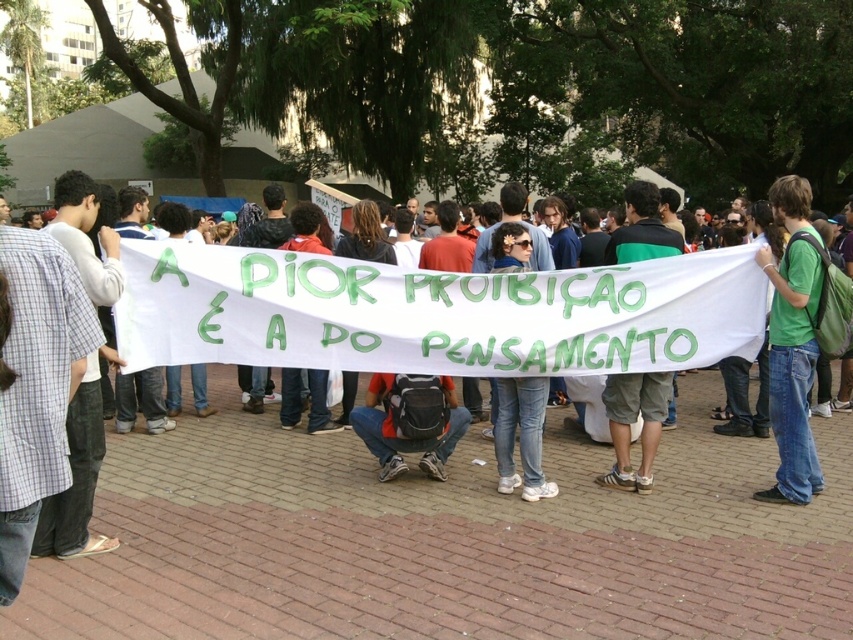
Question: Which of the following is the farthest from the observer?

Choices:
 (A) green cotton t-shirt at center-right
 (B) white fabric banner at center

Answer: (B)

Question: Can you confirm if white fabric banner at center is positioned to the left of green cotton t-shirt at center-right?

Choices:
 (A) yes
 (B) no

Answer: (A)

Question: Can you confirm if white fabric banner at center is thinner than green cotton t-shirt at center-right?

Choices:
 (A) no
 (B) yes

Answer: (A)

Question: Among these objects, which one is farthest from the camera?

Choices:
 (A) white fabric banner at center
 (B) green cotton t-shirt at center-right

Answer: (A)

Question: Can you confirm if white fabric banner at center is positioned to the right of green cotton t-shirt at center-right?

Choices:
 (A) no
 (B) yes

Answer: (A)